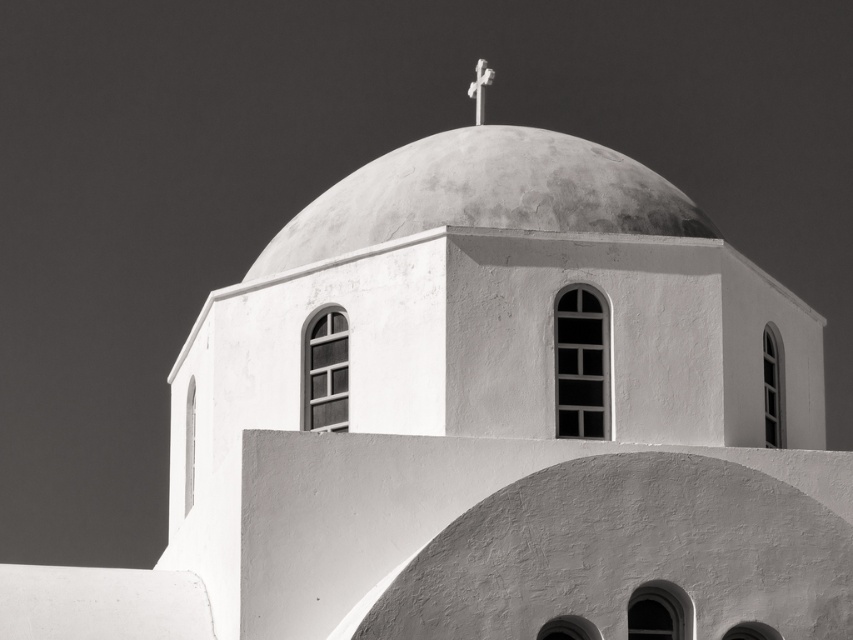
Which of these two, smooth concrete dome at center or white wooden cross at top center, stands shorter?

With less height is white wooden cross at top center.

Can you confirm if smooth concrete dome at center is positioned above white wooden cross at top center?

Incorrect, smooth concrete dome at center is not positioned above white wooden cross at top center.

Image resolution: width=853 pixels, height=640 pixels. Identify the location of smooth concrete dome at center. (x=485, y=195).